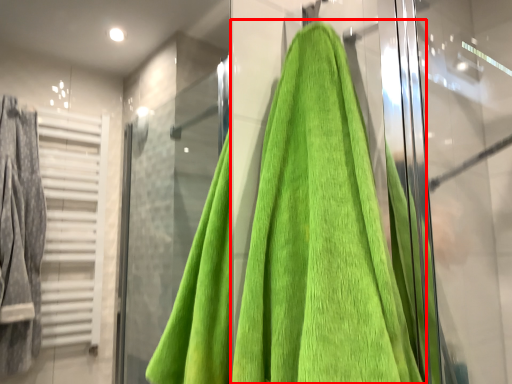
Question: From the image's perspective, what is the correct spatial positioning of towel (annotated by the red box) in reference to screen door?

Choices:
 (A) below
 (B) above

Answer: (A)